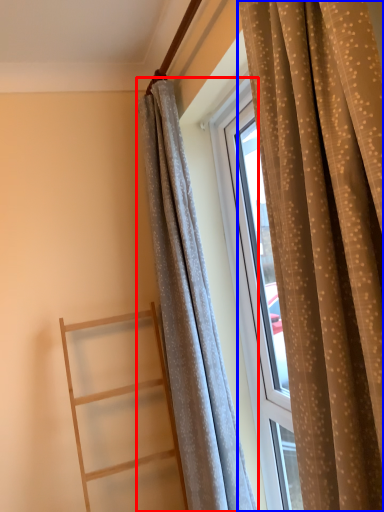
Question: Which of the following is the farthest to the observer, curtain (highlighted by a red box) or curtain (highlighted by a blue box)?

Choices:
 (A) curtain
 (B) curtain

Answer: (A)